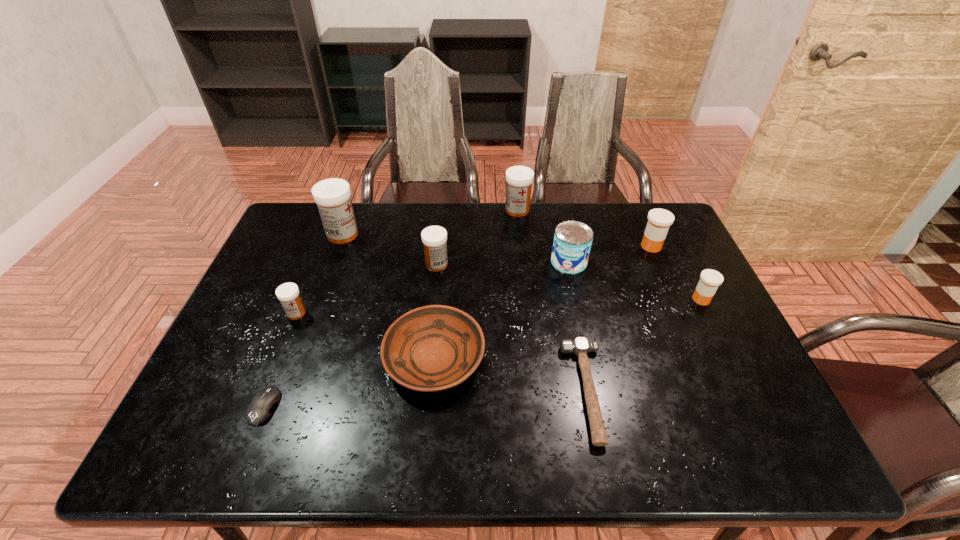
This screenshot has height=540, width=960. What are the coordinates of `vacant space that satisfies the following two spatial constraints: 1. on the back side of the black computer equipment; 2. on the right side of the plate` in the screenshot? It's located at (283, 358).